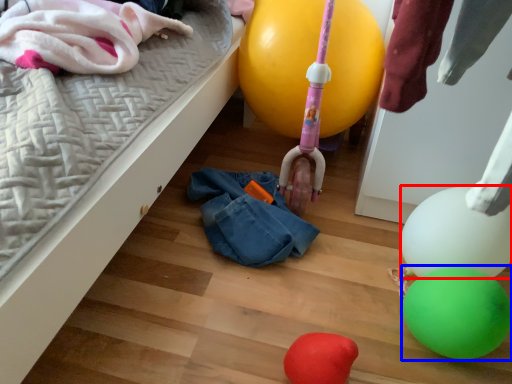
Question: Among these objects, which one is nearest to the camera, balloon (highlighted by a red box) or balloon (highlighted by a blue box)?

Choices:
 (A) balloon
 (B) balloon

Answer: (B)